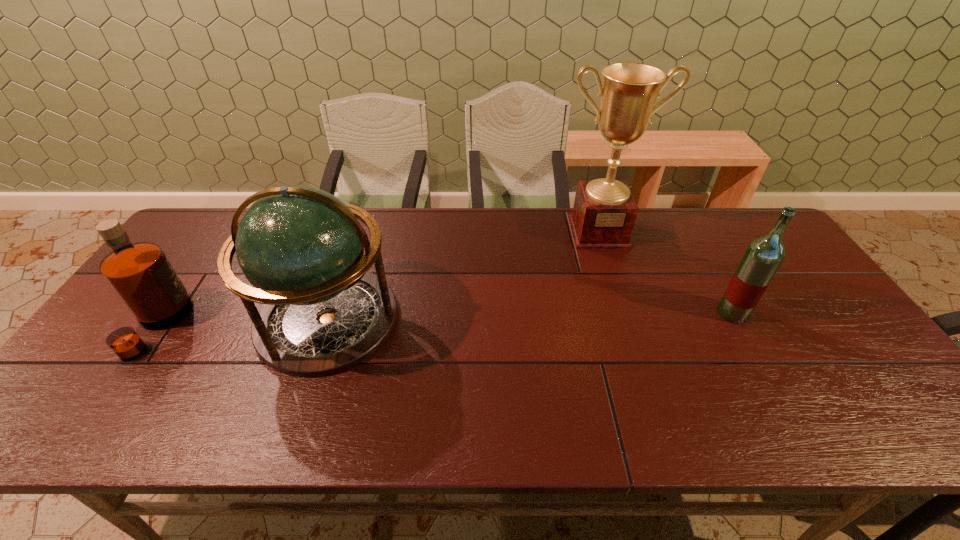
Where is `free space that is in between the right liquor and the tallest object`? Image resolution: width=960 pixels, height=540 pixels. free space that is in between the right liquor and the tallest object is located at coordinates (665, 273).

Where is `free space that is in between the tallest object and the rightmost object`? This screenshot has height=540, width=960. free space that is in between the tallest object and the rightmost object is located at coordinates (665, 273).

Identify the location of vacant area that lies between the rightmost object and the leftmost object. (445, 320).

Locate an element on the screen. free space between the right liquor and the left liquor is located at coordinates tap(445, 320).

At what (x,y) coordinates should I click in order to perform the action: click on empty space between the leftmost object and the third object from right to left. Please return your answer as a coordinate pair (x, y). This screenshot has height=540, width=960. Looking at the image, I should click on (243, 322).

The height and width of the screenshot is (540, 960). I want to click on object that is the third nearest to the third shortest object, so click(764, 255).

Select which object is the second closest to the rightmost object. Please provide its 2D coordinates. Your answer should be formatted as a tuple, i.e. [(x, y)], where the tuple contains the x and y coordinates of a point satisfying the conditions above.

[(302, 249)]

You are a GUI agent. You are given a task and a screenshot of the screen. Output one action in this format:
    pyautogui.click(x=<x>, y=<y>)
    Task: Click on the vacant position in the image that satisfies the following two spatial constraints: 1. on the front-facing side of the globe; 2. on the front label of the leftmost object
    The image size is (960, 540).
    Given the screenshot: What is the action you would take?
    pyautogui.click(x=325, y=326)

Find the location of `free location that satisfies the following two spatial constraints: 1. on the plaque of the farthest object; 2. on the front label of the left liquor`. free location that satisfies the following two spatial constraints: 1. on the plaque of the farthest object; 2. on the front label of the left liquor is located at coordinates (629, 326).

The height and width of the screenshot is (540, 960). What are the coordinates of `vacant space that satisfies the following two spatial constraints: 1. on the plaque of the second object from right to left; 2. on the left side of the rightmost object` in the screenshot? It's located at (625, 313).